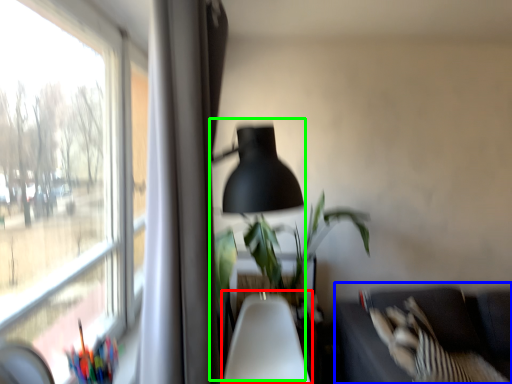
Question: Which object is positioned closest to swivel chair (highlighted by a red box)? Select from couch (highlighted by a blue box) and table lamp (highlighted by a green box).

Choices:
 (A) couch
 (B) table lamp

Answer: (A)